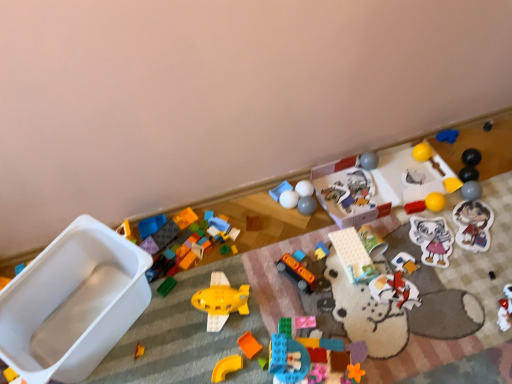
Image resolution: width=512 pixels, height=384 pixels. Identify the location of free space that is in between white matte figure at center, placed as the seventh toy when sorted from right to left, and translucent plastic blocks at center, arranged as the 11th toy when viewed from the left. (359, 324).